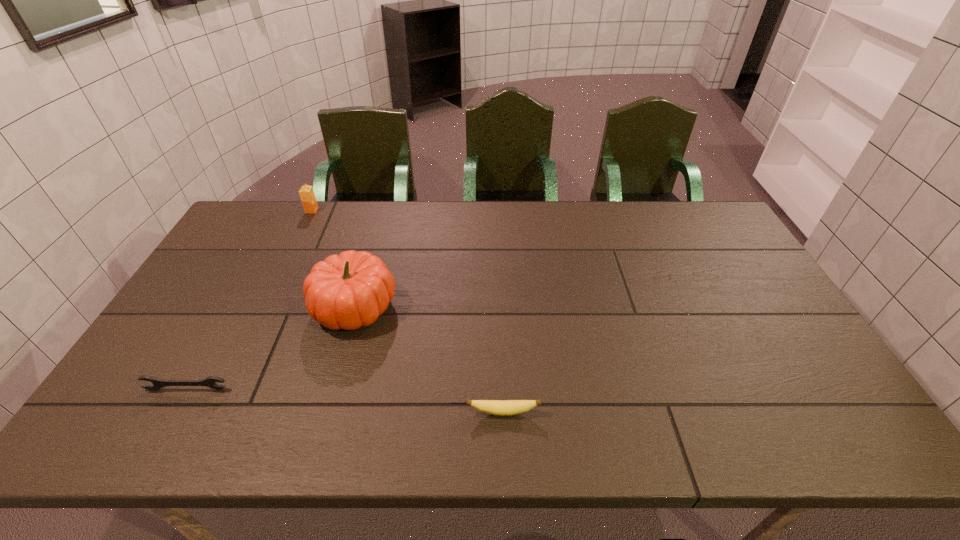
Where is `free space that is in between the third farthest object and the tallest object`? This screenshot has height=540, width=960. free space that is in between the third farthest object and the tallest object is located at coordinates coord(271,347).

Find the location of `vacant area that lies between the orange juice and the wrench`. vacant area that lies between the orange juice and the wrench is located at coordinates (250, 300).

Where is `free space between the second nearest object and the rightmost object`? The height and width of the screenshot is (540, 960). free space between the second nearest object and the rightmost object is located at coordinates (345, 400).

Locate an element on the screen. This screenshot has width=960, height=540. empty space between the second tallest object and the nearest object is located at coordinates (407, 311).

Identify the location of empty space that is in between the rightmost object and the wrench. (345, 400).

You are a GUI agent. You are given a task and a screenshot of the screen. Output one action in this format:
    pyautogui.click(x=<x>, y=<y>)
    Task: Click on the vacant area that lies between the second tallest object and the nearest object
    This screenshot has width=960, height=540.
    Given the screenshot: What is the action you would take?
    pyautogui.click(x=407, y=311)

I want to click on object that is the second closest to the second farthest object, so click(495, 407).

At what (x,y) coordinates should I click in order to perform the action: click on object that can be found as the second closest to the third farthest object. Please return your answer as a coordinate pair (x, y). The height and width of the screenshot is (540, 960). Looking at the image, I should click on (495, 407).

Find the location of `vacant point that satisfies the following two spatial constraints: 1. on the open ends of the nearest object; 2. on the left side of the wrench`. vacant point that satisfies the following two spatial constraints: 1. on the open ends of the nearest object; 2. on the left side of the wrench is located at coordinates (174, 412).

This screenshot has height=540, width=960. What are the coordinates of `vacant space that satisfies the following two spatial constraints: 1. on the open ends of the banana; 2. on the left side of the wrench` in the screenshot? It's located at (174, 412).